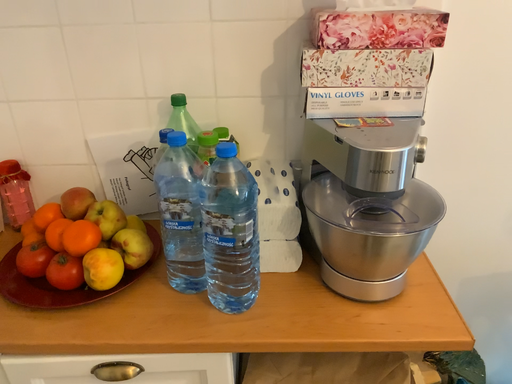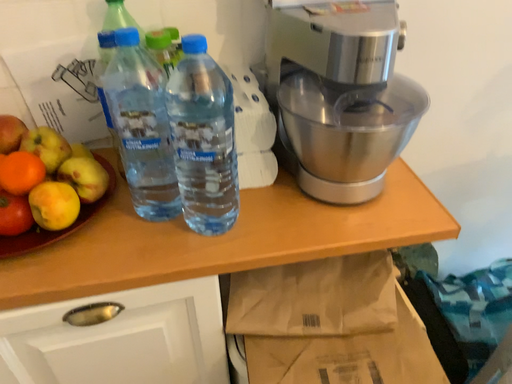
Question: How did the camera likely rotate when shooting the video?

Choices:
 (A) rotated upward
 (B) rotated downward

Answer: (B)